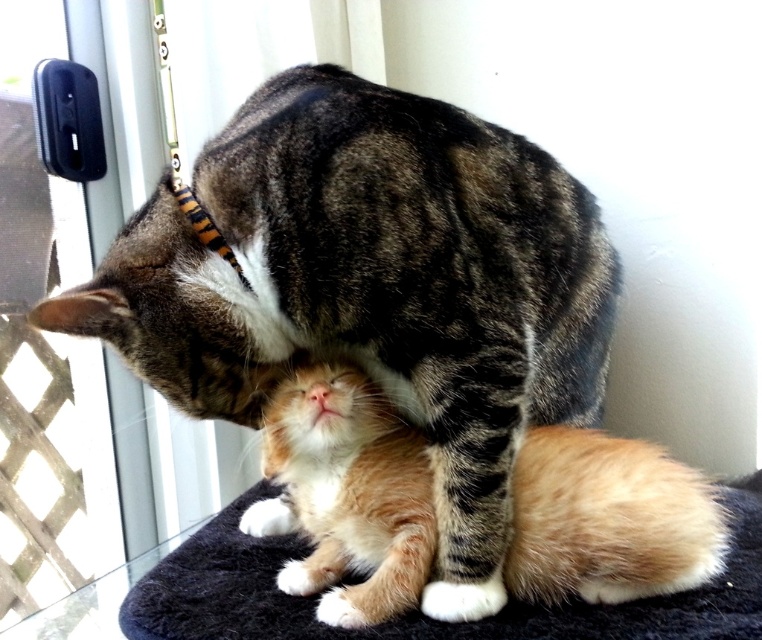
You are a photographer trying to capture a closeup of the orange fur kitten at center. However, the tabby fur cat at center is blocking the view. Can you adjust your position to see the kitten without moving either animal?

The orange fur kitten at center is behind the tabby fur cat at center, so moving your position to the side or slightly behind the tabby fur cat at center might allow you to see the kitten without moving them.

You are a photographer trying to capture the cats in the image. You want to focus on the point closer to you between the two points labeled as point (x=524, y=548) and point (x=175, y=189). Which point should you focus on?

You should focus on point (x=524, y=548) because it is closer to the viewer than point (x=175, y=189).